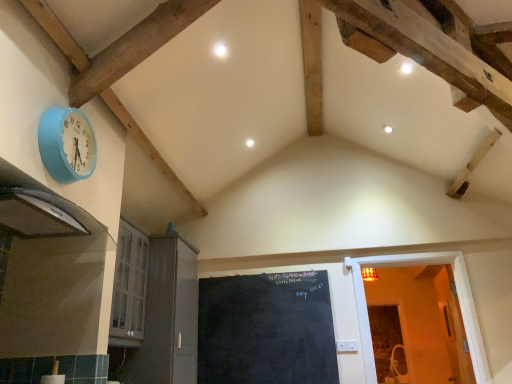
How much space does white glossy cabinet at lower left, placed as the second door when sorted from right to left, occupy horizontally?

white glossy cabinet at lower left, placed as the second door when sorted from right to left, is 25.86 inches wide.

Describe the element at coordinates (67, 144) in the screenshot. I see `blue fabric wall clock at upper left` at that location.

Identify the location of black chalkboard at center. (266, 329).

Considering the positions of objects wooden door at right, arranged as the first door when viewed from the right, and blue fabric wall clock at upper left in the image provided, who is in front, wooden door at right, arranged as the first door when viewed from the right, or blue fabric wall clock at upper left?

blue fabric wall clock at upper left is closer to the camera.

From the image's perspective, does wooden door at right, arranged as the first door when viewed from the right, appear higher than blue fabric wall clock at upper left?

No, from the image's perspective, wooden door at right, arranged as the first door when viewed from the right, is not over blue fabric wall clock at upper left.

Considering the relative sizes of wooden door at right, the second door viewed from the left, and blue fabric wall clock at upper left in the image provided, is wooden door at right, the second door viewed from the left, smaller than blue fabric wall clock at upper left?

No, wooden door at right, the second door viewed from the left, is not smaller than blue fabric wall clock at upper left.

Is wooden door at right, the second door viewed from the left, taller than blue fabric wall clock at upper left?

Correct, wooden door at right, the second door viewed from the left, is much taller as blue fabric wall clock at upper left.

Is white glossy cabinet at lower left, positioned as the first door in left-to-right order, situated inside wooden door at right, arranged as the first door when viewed from the right, or outside?

white glossy cabinet at lower left, positioned as the first door in left-to-right order, is not enclosed by wooden door at right, arranged as the first door when viewed from the right.

Is white glossy cabinet at lower left, placed as the second door when sorted from right to left, touching wooden door at right, arranged as the first door when viewed from the right?

No, white glossy cabinet at lower left, placed as the second door when sorted from right to left, is not beside wooden door at right, arranged as the first door when viewed from the right.

Consider the image. Which is more to the right, white glossy cabinet at lower left, positioned as the first door in left-to-right order, or wooden door at right, arranged as the first door when viewed from the right?

wooden door at right, arranged as the first door when viewed from the right.

From the image's perspective, is white glossy cabinet at lower left, placed as the second door when sorted from right to left, on top of wooden door at right, the second door viewed from the left?

Indeed, from the image's perspective, white glossy cabinet at lower left, placed as the second door when sorted from right to left, is shown above wooden door at right, the second door viewed from the left.

Is wooden door at right, arranged as the first door when viewed from the right, at the left side of black glossy exhaust hood at left?

In fact, wooden door at right, arranged as the first door when viewed from the right, is to the right of black glossy exhaust hood at left.

Image resolution: width=512 pixels, height=384 pixels. Identify the location of the 2nd door to the right when counting from the black glossy exhaust hood at left. (457, 293).

Is wooden door at right, the second door viewed from the left, bigger or smaller than black glossy exhaust hood at left?

wooden door at right, the second door viewed from the left, is bigger than black glossy exhaust hood at left.

From the image's perspective, would you say wooden door at right, arranged as the first door when viewed from the right, is shown under black glossy exhaust hood at left?

Yes.

Locate an element on the screen. The height and width of the screenshot is (384, 512). bulletin board below the white glossy cabinet at lower left, positioned as the first door in left-to-right order (from a real-world perspective) is located at coordinates [x=266, y=329].

Is black chalkboard at center next to white glossy cabinet at lower left, positioned as the first door in left-to-right order, and touching it?

No, black chalkboard at center is not touching white glossy cabinet at lower left, positioned as the first door in left-to-right order.

Between black chalkboard at center and white glossy cabinet at lower left, positioned as the first door in left-to-right order, which one appears on the right side from the viewer's perspective?

black chalkboard at center.

Is black chalkboard at center surrounding white glossy cabinet at lower left, placed as the second door when sorted from right to left?

No, white glossy cabinet at lower left, placed as the second door when sorted from right to left, is not inside black chalkboard at center.

Which is in front, blue fabric wall clock at upper left or white glossy cabinet at lower left, positioned as the first door in left-to-right order?

blue fabric wall clock at upper left is more forward.

Can you confirm if blue fabric wall clock at upper left is wider than white glossy cabinet at lower left, positioned as the first door in left-to-right order?

No.

Where is `door that is the 1st object located behind the blue fabric wall clock at upper left`? The width and height of the screenshot is (512, 384). door that is the 1st object located behind the blue fabric wall clock at upper left is located at coordinates (167, 317).

Does blue fabric wall clock at upper left have a smaller size compared to white glossy cabinet at lower left, positioned as the first door in left-to-right order?

Yes.

From a real-world perspective, does blue fabric wall clock at upper left stand above wooden door at right, arranged as the first door when viewed from the right?

Correct, in the physical world, blue fabric wall clock at upper left is higher than wooden door at right, arranged as the first door when viewed from the right.

Is point (40, 144) positioned before point (486, 365)?

Yes, it is.

Considering the relative sizes of blue fabric wall clock at upper left and wooden door at right, arranged as the first door when viewed from the right, in the image provided, is blue fabric wall clock at upper left thinner than wooden door at right, arranged as the first door when viewed from the right,?

Yes.

From the image's perspective, is blue fabric wall clock at upper left located above or below wooden door at right, the second door viewed from the left?

From the image's perspective, blue fabric wall clock at upper left appears above wooden door at right, the second door viewed from the left.

Who is taller, black glossy exhaust hood at left or white glossy cabinet at lower left, placed as the second door when sorted from right to left?

Standing taller between the two is white glossy cabinet at lower left, placed as the second door when sorted from right to left.

Is black glossy exhaust hood at left far away from white glossy cabinet at lower left, positioned as the first door in left-to-right order?

black glossy exhaust hood at left is positioned a significant distance from white glossy cabinet at lower left, positioned as the first door in left-to-right order.

Considering the positions of point (16, 167) and point (144, 352), is point (16, 167) closer or farther from the camera than point (144, 352)?

Point (16, 167) is closer to the camera than point (144, 352).

Does black glossy exhaust hood at left have a smaller size compared to white glossy cabinet at lower left, positioned as the first door in left-to-right order?

Correct, black glossy exhaust hood at left occupies less space than white glossy cabinet at lower left, positioned as the first door in left-to-right order.

The image size is (512, 384). What are the coordinates of `door that is the 2nd one below the blue fabric wall clock at upper left (from a real-world perspective)` in the screenshot? It's located at (457, 293).

Identify the location of door on the left of wooden door at right, the second door viewed from the left. The image size is (512, 384). (167, 317).

Based on their spatial positions, is wooden door at right, the second door viewed from the left, or black chalkboard at center closer to black glossy exhaust hood at left?

black chalkboard at center is closer to black glossy exhaust hood at left.

Which object lies nearer to the anchor point blue fabric wall clock at upper left, black chalkboard at center or white glossy cabinet at lower left, positioned as the first door in left-to-right order?

Among the two, white glossy cabinet at lower left, positioned as the first door in left-to-right order, is located nearer to blue fabric wall clock at upper left.

When comparing their distances from black chalkboard at center, does black glossy exhaust hood at left or white glossy cabinet at lower left, placed as the second door when sorted from right to left, seem closer?

white glossy cabinet at lower left, placed as the second door when sorted from right to left.

When comparing their distances from wooden door at right, the second door viewed from the left, does black glossy exhaust hood at left or black chalkboard at center seem closer?

black chalkboard at center is closer to wooden door at right, the second door viewed from the left.

When comparing their distances from wooden door at right, the second door viewed from the left, does blue fabric wall clock at upper left or white glossy cabinet at lower left, placed as the second door when sorted from right to left, seem further?

blue fabric wall clock at upper left lies further to wooden door at right, the second door viewed from the left, than the other object.

When comparing their distances from blue fabric wall clock at upper left, does black glossy exhaust hood at left or wooden door at right, the second door viewed from the left, seem further?

Among the two, wooden door at right, the second door viewed from the left, is located further to blue fabric wall clock at upper left.

From the image, which object appears to be farther from blue fabric wall clock at upper left, white glossy cabinet at lower left, positioned as the first door in left-to-right order, or black chalkboard at center?

black chalkboard at center is further to blue fabric wall clock at upper left.

Estimate the real-world distances between objects in this image. Which object is closer to white glossy cabinet at lower left, placed as the second door when sorted from right to left, wooden door at right, the second door viewed from the left, or blue fabric wall clock at upper left?

wooden door at right, the second door viewed from the left, is positioned closer to the anchor white glossy cabinet at lower left, placed as the second door when sorted from right to left.

I want to click on wall clock between white glossy cabinet at lower left, positioned as the first door in left-to-right order, and wooden door at right, the second door viewed from the left, from left to right, so click(67, 144).

Find the location of `bulletin board situated between white glossy cabinet at lower left, placed as the second door when sorted from right to left, and wooden door at right, arranged as the first door when viewed from the right, from left to right`. bulletin board situated between white glossy cabinet at lower left, placed as the second door when sorted from right to left, and wooden door at right, arranged as the first door when viewed from the right, from left to right is located at coordinates (266, 329).

This screenshot has width=512, height=384. What are the coordinates of `bulletin board between black glossy exhaust hood at left and wooden door at right, arranged as the first door when viewed from the right, in the horizontal direction` in the screenshot? It's located at click(x=266, y=329).

Where is `bulletin board situated between blue fabric wall clock at upper left and wooden door at right, arranged as the first door when viewed from the right, from left to right`? bulletin board situated between blue fabric wall clock at upper left and wooden door at right, arranged as the first door when viewed from the right, from left to right is located at coordinates pyautogui.click(x=266, y=329).